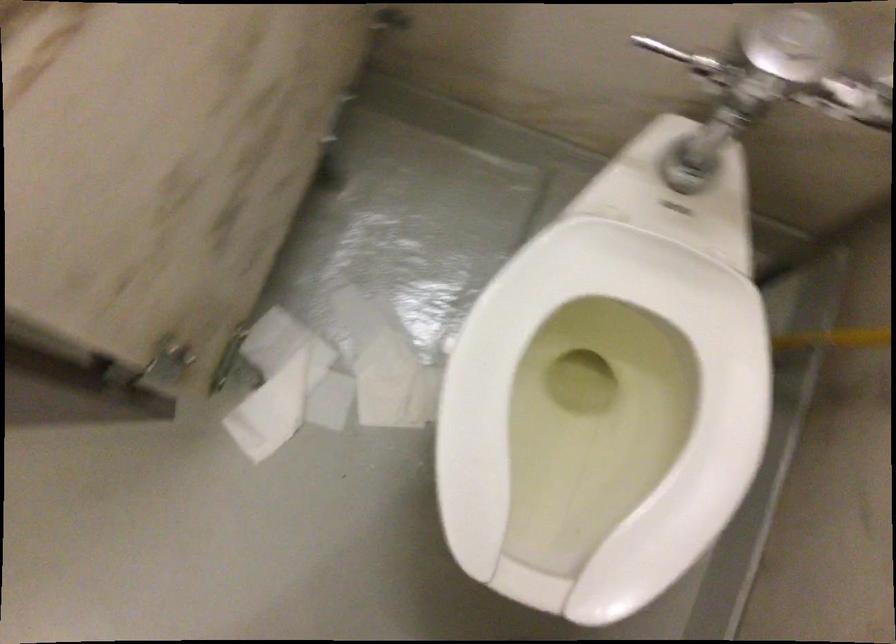
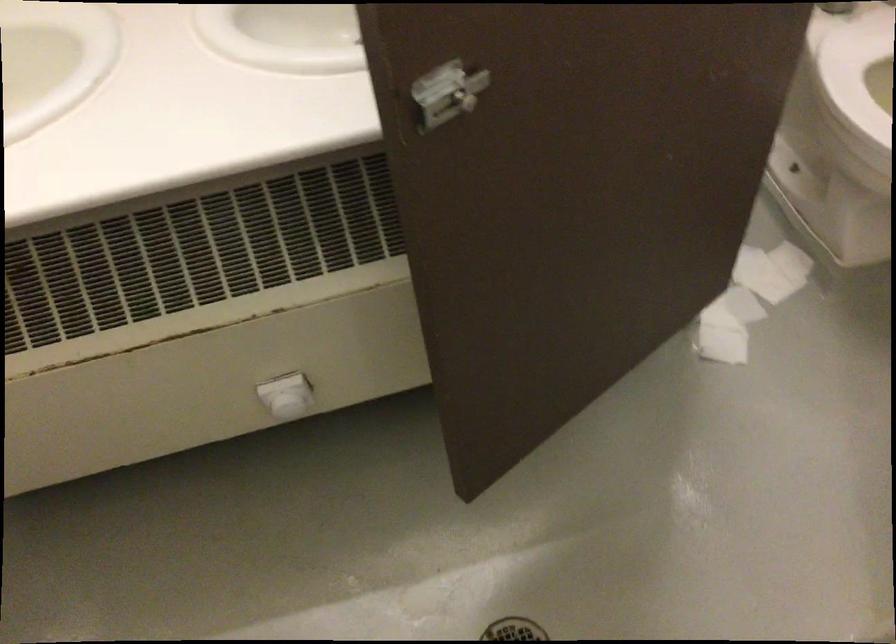
Where in the second image is the point corresponding to (418,408) from the first image?

(790, 261)